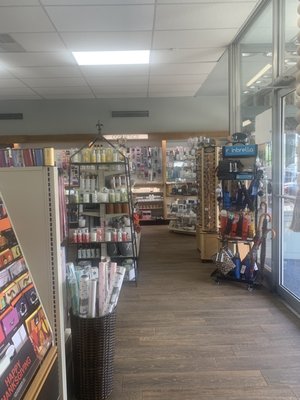
Locate an element on the screen. The height and width of the screenshot is (400, 300). vent is located at coordinates (136, 112).